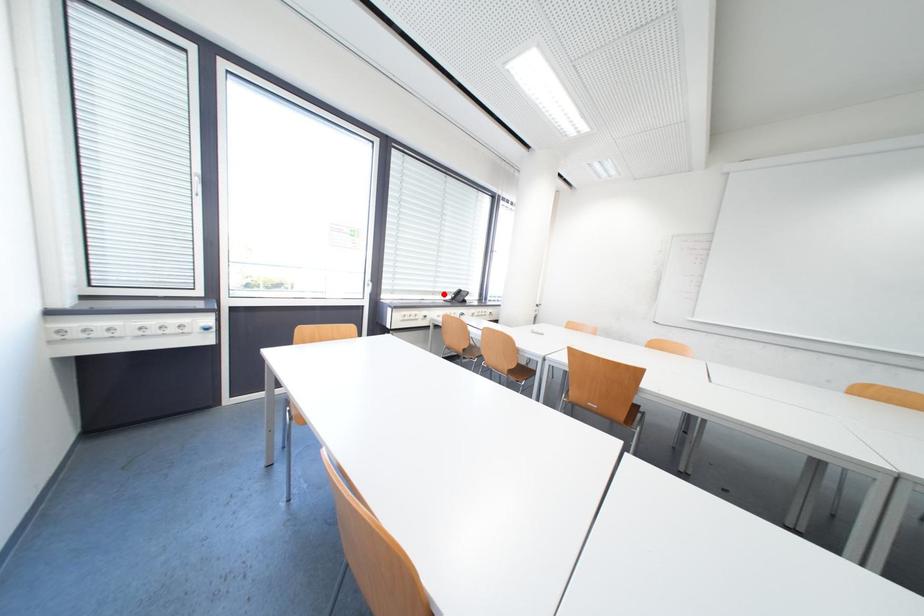
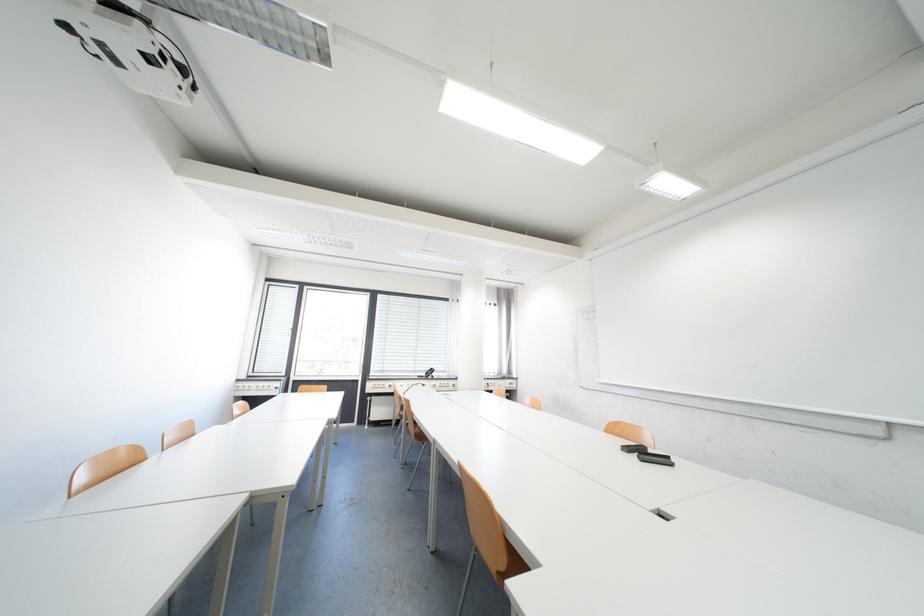
Find the pixel in the second image that matches the highlighted location in the first image.

(426, 371)